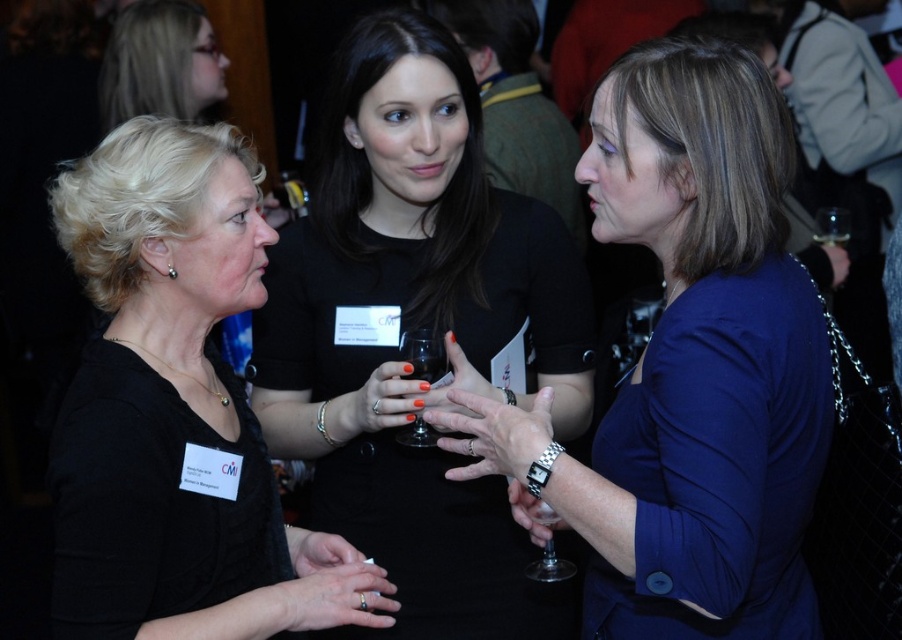
You are at a networking event and want to introduce yourself to the group. The blonde hair at upper left and transparent glass at center are part of the scene. Which object is located above the other?

The blonde hair at upper left is positioned over transparent glass at center, so the blonde hair at upper left is above the transparent glass at center.

You are at a networking event and need to hand a business card to the woman in the blue fabric jacket at center. You are standing behind the transparent glass wine glass at center. Can you directly hand her the card without moving the glass?

The blue fabric jacket at center is closer to the viewer than the transparent glass wine glass at center, so you can directly hand her the card without moving the glass because the jacket is nearer to you than the wine glass.